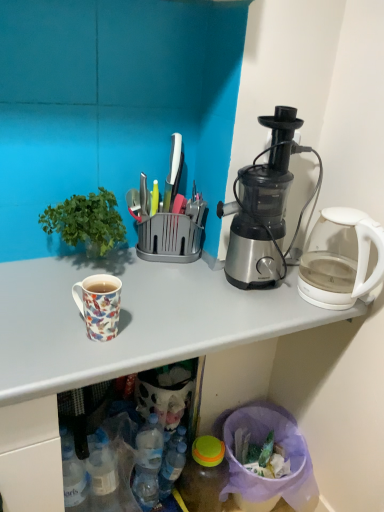
The width and height of the screenshot is (384, 512). In order to click on blank space to the left of transparent glass kettle at right in this screenshot , I will do `click(271, 309)`.